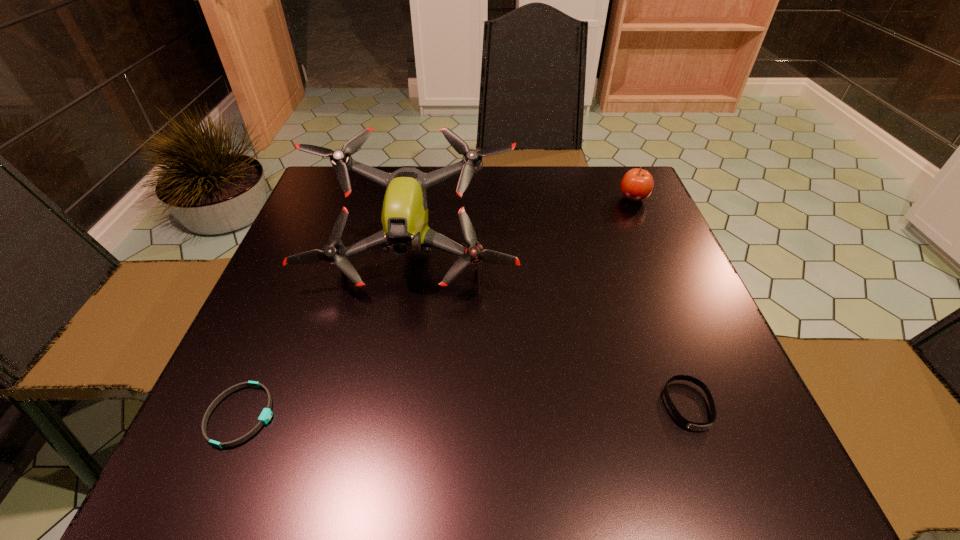
Find the location of a particular element. The height and width of the screenshot is (540, 960). vacant region between the left wristband and the right wristband is located at coordinates (465, 410).

The height and width of the screenshot is (540, 960). Find the location of `free space between the third tallest object and the second tallest object`. free space between the third tallest object and the second tallest object is located at coordinates (660, 302).

I want to click on vacant region between the right wristband and the third shortest object, so click(660, 302).

Identify the location of vacant region between the third nearest object and the farthest object. The height and width of the screenshot is (540, 960). (522, 228).

Locate an element on the screen. This screenshot has width=960, height=540. free space between the drone and the shortest object is located at coordinates (326, 336).

The width and height of the screenshot is (960, 540). I want to click on vacant space in between the second tallest object and the right wristband, so (660, 302).

Where is `object that is the second closest one to the drone`? The image size is (960, 540). object that is the second closest one to the drone is located at coordinates (637, 184).

Locate an element on the screen. This screenshot has width=960, height=540. object that is the third nearest to the shortest object is located at coordinates (637, 184).

Image resolution: width=960 pixels, height=540 pixels. I want to click on vacant space that satisfies the following two spatial constraints: 1. on the front-facing side of the tallest object; 2. on the buckle of the left wristband, so click(x=385, y=415).

Locate an element on the screen. The height and width of the screenshot is (540, 960). free space that satisfies the following two spatial constraints: 1. on the front side of the farthest object; 2. on the buckle of the left wristband is located at coordinates (729, 415).